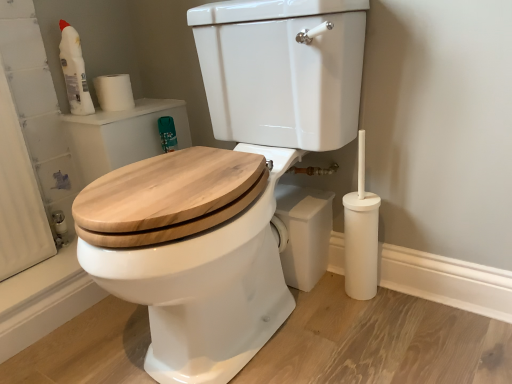
Question: From a real-world perspective, is white plastic toilet brush at lower right physically located above or below natural wood toilet seat at center?

Choices:
 (A) above
 (B) below

Answer: (B)

Question: Looking at their shapes, would you say white plastic toilet brush at lower right is wider or thinner than natural wood toilet seat at center?

Choices:
 (A) wide
 (B) thin

Answer: (B)

Question: Estimate the real-world distances between objects in this image. Which object is farther from the white plastic toilet brush at lower right?

Choices:
 (A) white plastic bottle at upper left
 (B) natural wood toilet seat at center
 (C) white matte toilet paper at upper left

Answer: (A)

Question: Based on their relative distances, which object is farther from the natural wood toilet seat at center?

Choices:
 (A) white matte toilet paper at upper left
 (B) white plastic toilet brush at lower right
 (C) white plastic bottle at upper left

Answer: (C)